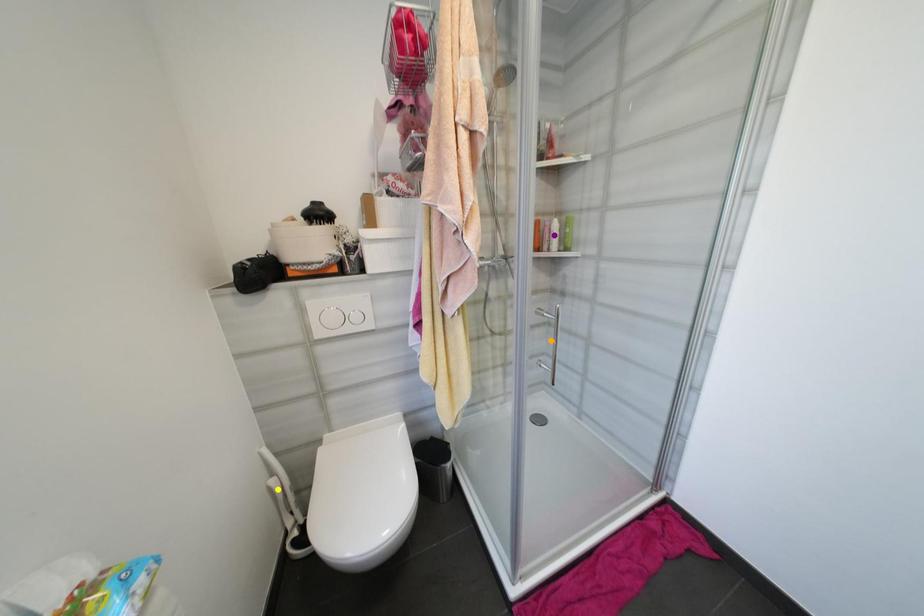
Order these from nearest to farthest:
A) yellow point
B) orange point
C) purple point

orange point → yellow point → purple point